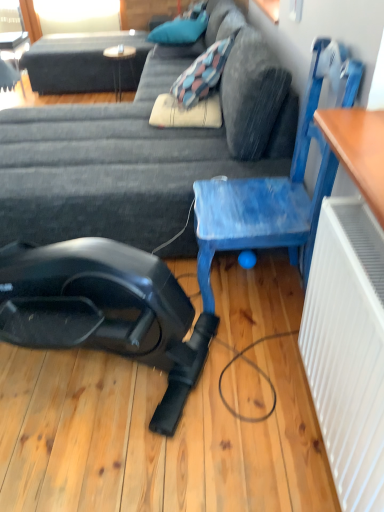
Question: Should I look upward or downward to see blue painted wood chair at center right?

Choices:
 (A) down
 (B) up

Answer: (B)

Question: Can you confirm if wooden table at upper center is thinner than blue fabric pillow at upper center?

Choices:
 (A) no
 (B) yes

Answer: (B)

Question: Is the position of wooden table at upper center more distant than that of blue fabric pillow at upper center?

Choices:
 (A) no
 (B) yes

Answer: (B)

Question: From a real-world perspective, is wooden table at upper center on blue fabric pillow at upper center?

Choices:
 (A) no
 (B) yes

Answer: (A)

Question: Is the depth of wooden table at upper center less than that of blue fabric pillow at upper center?

Choices:
 (A) no
 (B) yes

Answer: (A)

Question: Is blue fabric pillow at upper center inside wooden table at upper center?

Choices:
 (A) yes
 (B) no

Answer: (B)

Question: Is wooden table at upper center smaller than blue fabric pillow at upper center?

Choices:
 (A) no
 (B) yes

Answer: (B)

Question: Can you see blue painted wood chair at center right touching dark gray fabric couch at center?

Choices:
 (A) no
 (B) yes

Answer: (A)

Question: Is blue painted wood chair at center right aimed at dark gray fabric couch at center?

Choices:
 (A) no
 (B) yes

Answer: (A)

Question: Is dark gray fabric couch at center a part of blue painted wood chair at center right?

Choices:
 (A) no
 (B) yes

Answer: (A)

Question: Does blue painted wood chair at center right lie in front of dark gray fabric couch at center?

Choices:
 (A) no
 (B) yes

Answer: (B)

Question: From a real-world perspective, is blue painted wood chair at center right below dark gray fabric couch at center?

Choices:
 (A) no
 (B) yes

Answer: (A)

Question: Does blue painted wood chair at center right appear on the right side of dark gray fabric couch at center?

Choices:
 (A) no
 (B) yes

Answer: (B)

Question: Does wooden table at upper center come behind blue painted wood chair at center right?

Choices:
 (A) yes
 (B) no

Answer: (A)